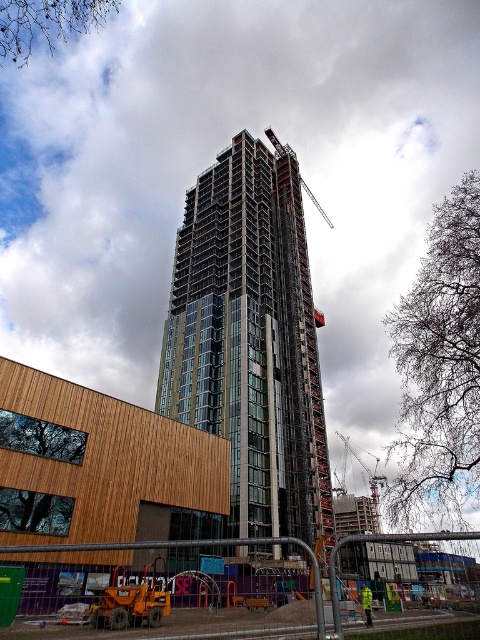
Is orange construction equipment at lower left shorter than yellow reflective jacket at center?

In fact, orange construction equipment at lower left may be taller than yellow reflective jacket at center.

Is point (55, 547) farther from viewer compared to point (368, 598)?

No, it is not.

Who is more distant from viewer, (128, 545) or (368, 605)?

Positioned behind is point (368, 605).

I want to click on orange construction equipment at lower left, so click(x=180, y=547).

The height and width of the screenshot is (640, 480). What do you see at coordinates (180, 547) in the screenshot?
I see `orange construction equipment at lower left` at bounding box center [180, 547].

Where is `orange construction equipment at lower left`? This screenshot has width=480, height=640. orange construction equipment at lower left is located at coordinates (180, 547).

Does metallic gray crane at center appear on the left side of yellow reflective jacket at center?

In fact, metallic gray crane at center is to the right of yellow reflective jacket at center.

Identify the location of metallic gray crane at center. (369, 481).